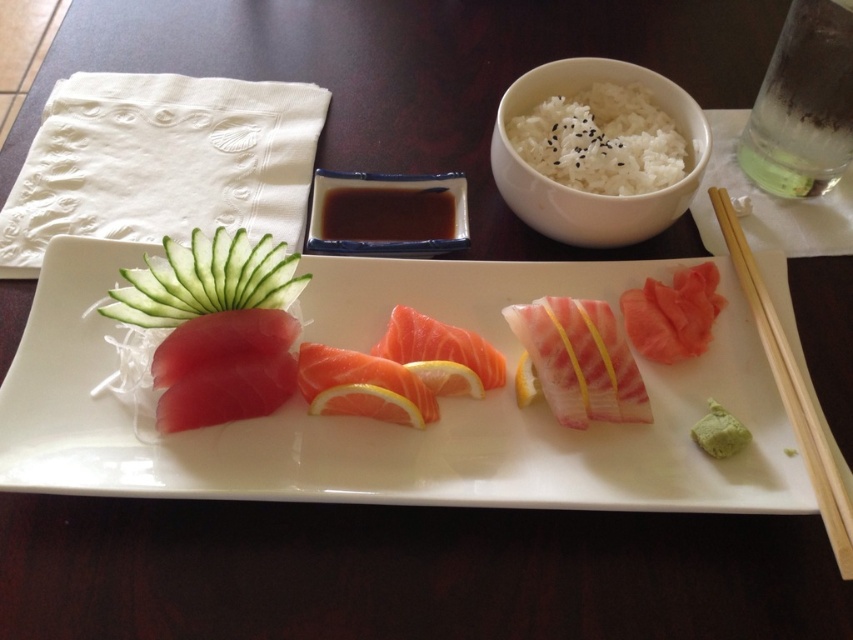
Based on the photo, between sashimi plate at center and pink raw salmon at center, which one appears on the right side from the viewer's perspective?

Positioned to the right is pink raw salmon at center.

How far apart are sashimi plate at center and pink raw salmon at center?

They are 12.24 centimeters apart.

Describe the element at coordinates (392, 424) in the screenshot. I see `sashimi plate at center` at that location.

You are a GUI agent. You are given a task and a screenshot of the screen. Output one action in this format:
    pyautogui.click(x=<x>, y=<y>)
    Task: Click on the sashimi plate at center
    
    Given the screenshot: What is the action you would take?
    click(x=392, y=424)

Which is below, green smooth cucumber at left or pink glossy salmon at center?

pink glossy salmon at center is below.

Who is taller, green smooth cucumber at left or pink glossy salmon at center?

With more height is pink glossy salmon at center.

Between point (200, 264) and point (665, 310), which one is positioned in front?

Point (200, 264) is in front.

Image resolution: width=853 pixels, height=640 pixels. Identify the location of green smooth cucumber at left. (207, 280).

Does white matte rice bowl at upper center come in front of pink glossy salmon at center?

No, it is not.

Which is above, white matte rice bowl at upper center or pink glossy salmon at center?

white matte rice bowl at upper center is above.

Which is in front, point (531, 218) or point (691, 276)?

Point (691, 276)

Image resolution: width=853 pixels, height=640 pixels. I want to click on white matte rice bowl at upper center, so click(579, 189).